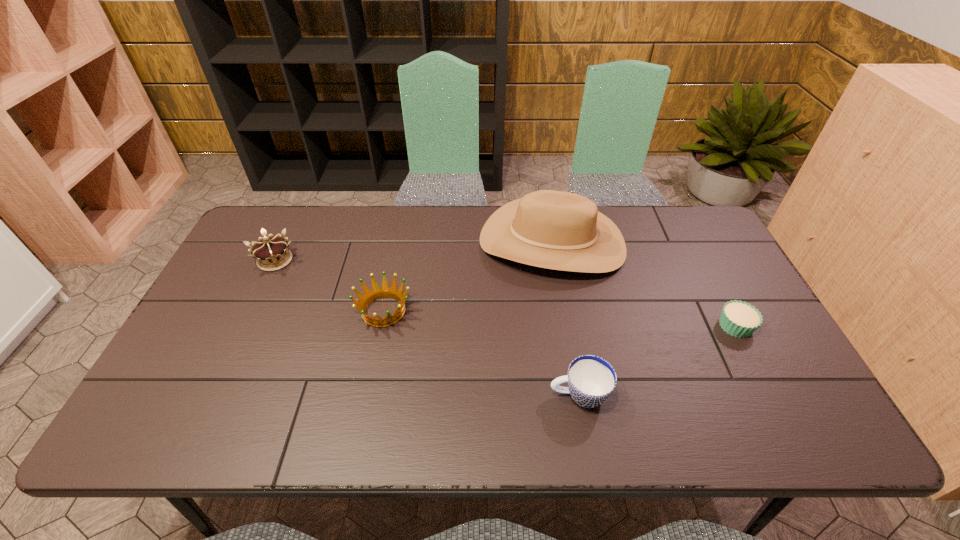
The image size is (960, 540). What are the coordinates of `object present at the far left corner` in the screenshot? It's located at (270, 252).

Where is `free space at the far edge of the desktop`? free space at the far edge of the desktop is located at coordinates (465, 224).

Image resolution: width=960 pixels, height=540 pixels. Find the location of `vacant space at the near edge of the desktop`. vacant space at the near edge of the desktop is located at coordinates (468, 410).

This screenshot has height=540, width=960. Find the location of `free space at the left edge of the desktop`. free space at the left edge of the desktop is located at coordinates (210, 370).

The width and height of the screenshot is (960, 540). In the image, there is a desktop. Identify the location of vacant space at the right edge. (808, 400).

In the image, there is a desktop. What are the coordinates of `free region at the far left corner` in the screenshot? It's located at (276, 218).

Image resolution: width=960 pixels, height=540 pixels. I want to click on free location at the far right corner of the desktop, so click(x=697, y=210).

Find the location of `vacant space that is in between the left crown and the shortest object`. vacant space that is in between the left crown and the shortest object is located at coordinates (505, 293).

The height and width of the screenshot is (540, 960). In order to click on empty location between the leftmost object and the shorter crown in this screenshot , I will do `click(329, 286)`.

This screenshot has width=960, height=540. I want to click on vacant region between the nearest object and the nearer crown, so click(481, 353).